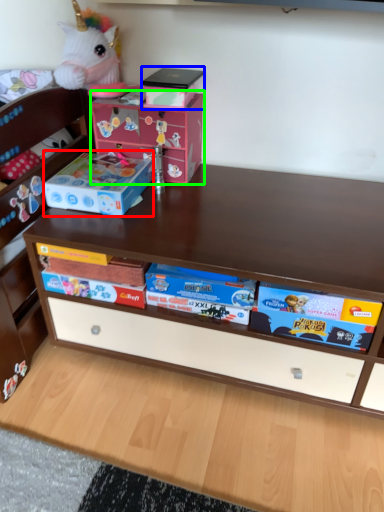
Question: Which object is positioned farthest from storage box (highlighted by a red box)? Select from box (highlighted by a blue box) and cardboard box (highlighted by a green box).

Choices:
 (A) box
 (B) cardboard box

Answer: (A)